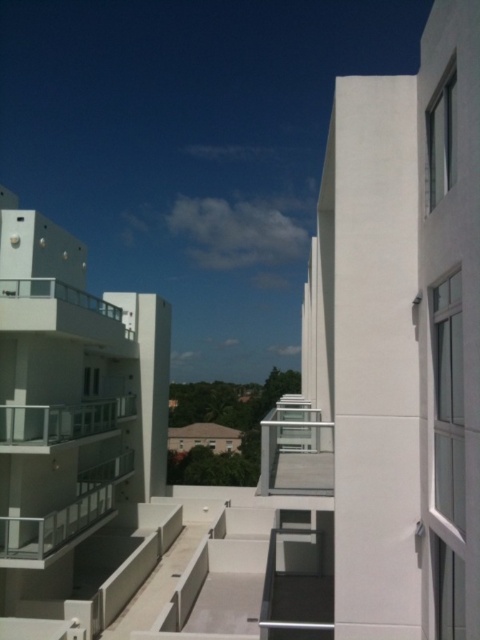
The height and width of the screenshot is (640, 480). In order to click on clear glass balcony at center in this screenshot , I will do `click(61, 420)`.

Find the location of a particular element. The image size is (480, 640). clear glass balcony at center is located at coordinates (61, 420).